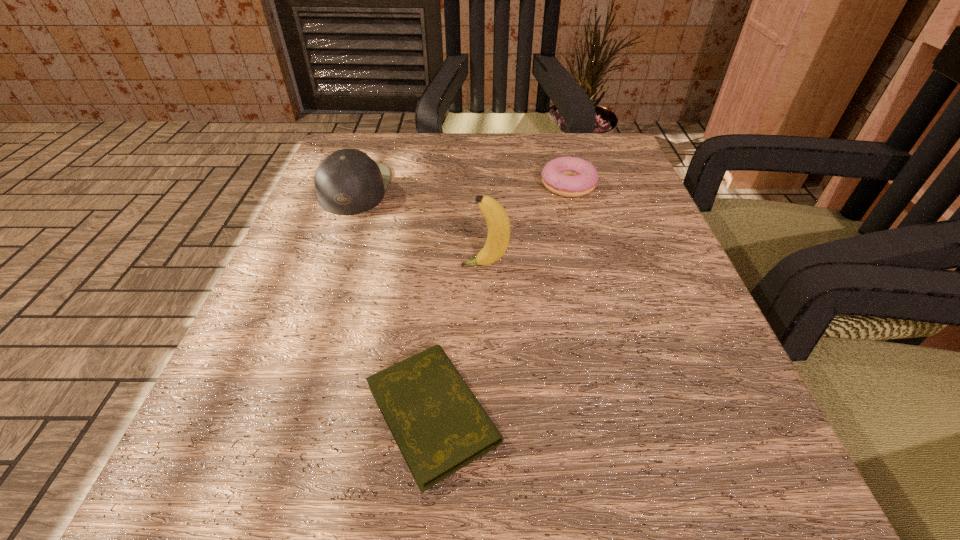
Where is `vacant area that lies between the nearest object and the leftmost object`? The height and width of the screenshot is (540, 960). vacant area that lies between the nearest object and the leftmost object is located at coordinates (394, 301).

This screenshot has width=960, height=540. I want to click on vacant point located between the third shortest object and the nearest object, so click(x=394, y=301).

What are the coordinates of `vacant area that lies between the third shortest object and the second shortest object` in the screenshot? It's located at (462, 187).

Where is `vacant space in between the banana and the second shortest object`? Image resolution: width=960 pixels, height=540 pixels. vacant space in between the banana and the second shortest object is located at coordinates (526, 225).

The image size is (960, 540). I want to click on free space between the banana and the third tallest object, so click(526, 225).

Where is `free spot between the diary and the third farthest object`? free spot between the diary and the third farthest object is located at coordinates (459, 339).

Find the location of a particular element. free spot between the cap and the second nearest object is located at coordinates (420, 227).

In order to click on vacant space that's between the tallest object and the diary in this screenshot , I will do `click(459, 339)`.

Identify the location of object that ranks as the closest to the rightmost object. The image size is (960, 540). (497, 219).

Image resolution: width=960 pixels, height=540 pixels. I want to click on object that ranks as the second closest to the banana, so click(x=567, y=176).